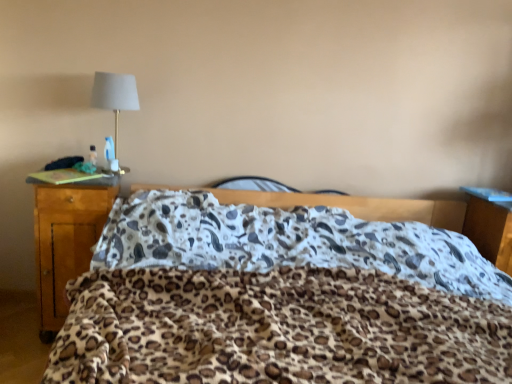
What do you see at coordinates (280, 299) in the screenshot? I see `leopard print blanket at center` at bounding box center [280, 299].

Locate an element on the screen. wooden nightstand at right is located at coordinates (490, 225).

Consider the image. Measure the distance between point (477, 217) and camera.

A distance of 7.72 feet exists between point (477, 217) and camera.

Locate an element on the screen. leopard print blanket at center is located at coordinates (280, 299).

Image resolution: width=512 pixels, height=384 pixels. I want to click on desk lying below the matte gold lamp at upper left (from the image's perspective), so click(x=65, y=242).

Which object is further away from the camera, matte gold lamp at upper left or wooden desk at left?

matte gold lamp at upper left is further from the camera.

Which is correct: matte gold lamp at upper left is inside wooden desk at left, or outside of it?

matte gold lamp at upper left is spatially situated outside wooden desk at left.

From a real-world perspective, between leopard print blanket at center and matte gold lamp at upper left, who is vertically lower?

leopard print blanket at center.

Can you tell me how much leopard print blanket at center and matte gold lamp at upper left differ in facing direction?

There is a 4.49-degree angle between the facing directions of leopard print blanket at center and matte gold lamp at upper left.

In the scene shown: Is there a large distance between leopard print blanket at center and matte gold lamp at upper left?

leopard print blanket at center is far away from matte gold lamp at upper left.

Is leopard print blanket at center not inside matte gold lamp at upper left?

Yes, leopard print blanket at center is outside of matte gold lamp at upper left.

Considering their positions, is leopard print blanket at center located in front of or behind wooden desk at left?

Clearly, leopard print blanket at center is in front of wooden desk at left.

Is leopard print blanket at center placed right next to wooden desk at left?

No, leopard print blanket at center is not next to wooden desk at left.

From a real-world perspective, which is physically below, leopard print blanket at center or wooden desk at left?

In real-world perspective, leopard print blanket at center is lower.

Is wooden nightstand at right at the left side of matte gold lamp at upper left?

In fact, wooden nightstand at right is to the right of matte gold lamp at upper left.

Can we say wooden nightstand at right lies outside matte gold lamp at upper left?

Yes.

The height and width of the screenshot is (384, 512). I want to click on lamp that is above the wooden nightstand at right (from the image's perspective), so click(115, 95).

From a real-world perspective, is wooden nightstand at right on matte gold lamp at upper left?

Actually, wooden nightstand at right is physically below matte gold lamp at upper left in the real world.

From a real-world perspective, is wooden desk at left physically below wooden nightstand at right?

Yes.

Which is more to the right, wooden desk at left or wooden nightstand at right?

wooden nightstand at right.

From the picture: Is wooden desk at left positioned in front of wooden nightstand at right?

Yes, it is.

Based on their sizes in the image, would you say wooden desk at left is bigger or smaller than wooden nightstand at right?

In the image, wooden desk at left appears to be larger than wooden nightstand at right.

Looking at the image, does wooden nightstand at right seem bigger or smaller compared to leopard print blanket at center?

Clearly, wooden nightstand at right is smaller in size than leopard print blanket at center.

Does wooden nightstand at right have a greater height compared to leopard print blanket at center?

No, wooden nightstand at right is not taller than leopard print blanket at center.

What's the angular difference between wooden nightstand at right and leopard print blanket at center's facing directions?

The angle between the facing direction of wooden nightstand at right and the facing direction of leopard print blanket at center is 4.49 degrees.

From the image's perspective, is wooden nightstand at right located above or below leopard print blanket at center?

Based on their image positions, wooden nightstand at right is located above leopard print blanket at center.

Consider the image. Which object is positioned more to the right, matte gold lamp at upper left or wooden nightstand at right?

wooden nightstand at right is more to the right.

Based on the photo, is matte gold lamp at upper left bigger than wooden nightstand at right?

No.

Which object is wider, matte gold lamp at upper left or wooden nightstand at right?

With larger width is wooden nightstand at right.

Is matte gold lamp at upper left not close to wooden nightstand at right?

Yes, matte gold lamp at upper left and wooden nightstand at right are quite far apart.

Locate an element on the screen. Image resolution: width=512 pixels, height=384 pixels. lamp that is above the wooden desk at left (from the image's perspective) is located at coordinates (115, 95).

The height and width of the screenshot is (384, 512). In order to click on bed that is below the matte gold lamp at upper left (from the image's perspective) in this screenshot , I will do `click(280, 299)`.

Which object lies further to the anchor point wooden desk at left, wooden nightstand at right or matte gold lamp at upper left?

wooden nightstand at right is further to wooden desk at left.

Considering their positions, is wooden nightstand at right positioned closer to leopard print blanket at center than wooden desk at left?

wooden desk at left.

Estimate the real-world distances between objects in this image. Which object is closer to matte gold lamp at upper left, wooden nightstand at right or wooden desk at left?

Among the two, wooden desk at left is located nearer to matte gold lamp at upper left.

When comparing their distances from wooden desk at left, does matte gold lamp at upper left or wooden nightstand at right seem further?

Among the two, wooden nightstand at right is located further to wooden desk at left.

Which object lies nearer to the anchor point matte gold lamp at upper left, leopard print blanket at center or wooden nightstand at right?

The object closer to matte gold lamp at upper left is leopard print blanket at center.

From the image, which object appears to be nearer to leopard print blanket at center, matte gold lamp at upper left or wooden nightstand at right?

Among the two, wooden nightstand at right is located nearer to leopard print blanket at center.

Based on their spatial positions, is leopard print blanket at center or wooden desk at left closer to wooden nightstand at right?

leopard print blanket at center is positioned closer to the anchor wooden nightstand at right.

Considering their positions, is leopard print blanket at center positioned closer to matte gold lamp at upper left than wooden desk at left?

wooden desk at left is closer to matte gold lamp at upper left.

This screenshot has height=384, width=512. I want to click on lamp located between wooden desk at left and wooden nightstand at right in the left-right direction, so click(115, 95).

Locate an element on the screen. This screenshot has height=384, width=512. desk between leopard print blanket at center and matte gold lamp at upper left in the front-back direction is located at coordinates (65, 242).

Identify the location of bed between wooden desk at left and wooden nightstand at right in the horizontal direction. (280, 299).

I want to click on bed situated between matte gold lamp at upper left and wooden nightstand at right from left to right, so click(280, 299).